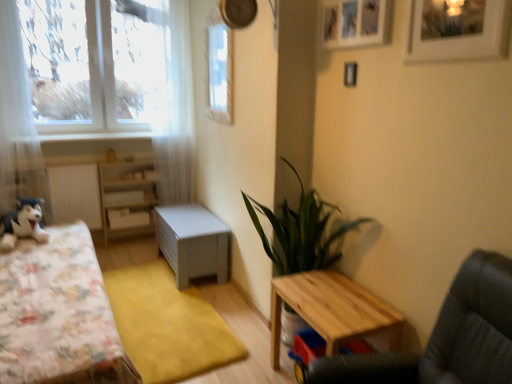
The image size is (512, 384). Find the location of `free space in front of matte gray chest at center, the second table positioned from the right`. free space in front of matte gray chest at center, the second table positioned from the right is located at coordinates coord(193,296).